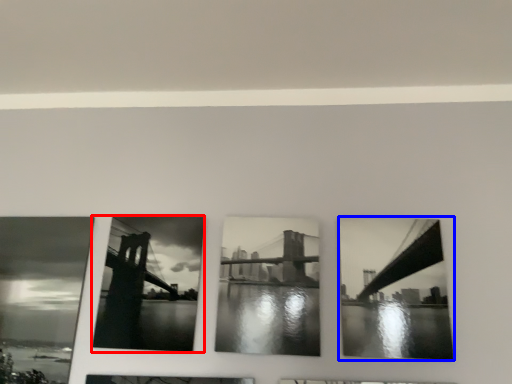
Question: Among these objects, which one is nearest to the camera, picture frame (highlighted by a red box) or picture frame (highlighted by a blue box)?

Choices:
 (A) picture frame
 (B) picture frame

Answer: (B)